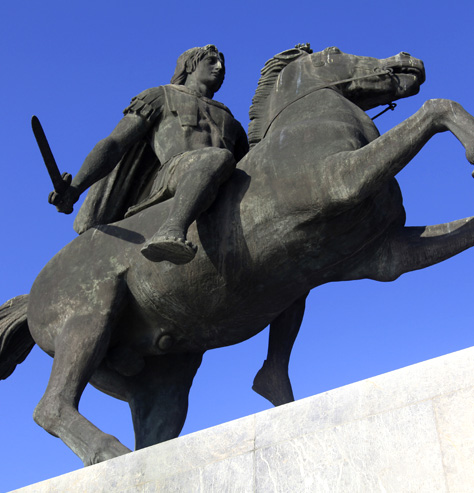
Find the location of a particular element. The width and height of the screenshot is (474, 493). horse statue's head is located at coordinates (205, 64), (359, 63).